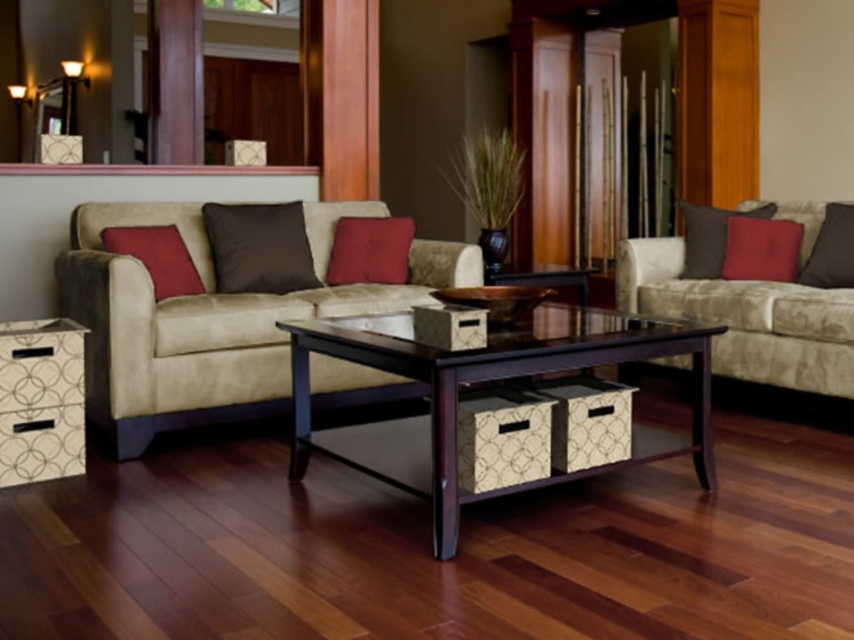
Does point (238, 390) come farther from viewer compared to point (764, 269)?

No, it is not.

Looking at this image, can you confirm if suede beige couch at center is shorter than matte red pillow at right?

Incorrect, suede beige couch at center's height does not fall short of matte red pillow at right's.

Find the location of `suede beige couch at center`. suede beige couch at center is located at coordinates (226, 300).

Does point (51, 458) lie in front of point (816, 275)?

Yes, point (51, 458) is closer to viewer.

Is white textured side table at lower left shorter than brown suede pillow at right?

No.

Identify the location of white textured side table at lower left. This screenshot has height=640, width=854. (39, 401).

Consider the image. Is white textured side table at lower left taller than satin brown pillow at center?

Yes.

Does white textured side table at lower left have a lesser height compared to satin brown pillow at center?

Incorrect, white textured side table at lower left's height does not fall short of satin brown pillow at center's.

Who is more distant from viewer, (x=19, y=388) or (x=259, y=280)?

Point (x=259, y=280)

Locate an element on the screen. The image size is (854, 640). white textured side table at lower left is located at coordinates (39, 401).